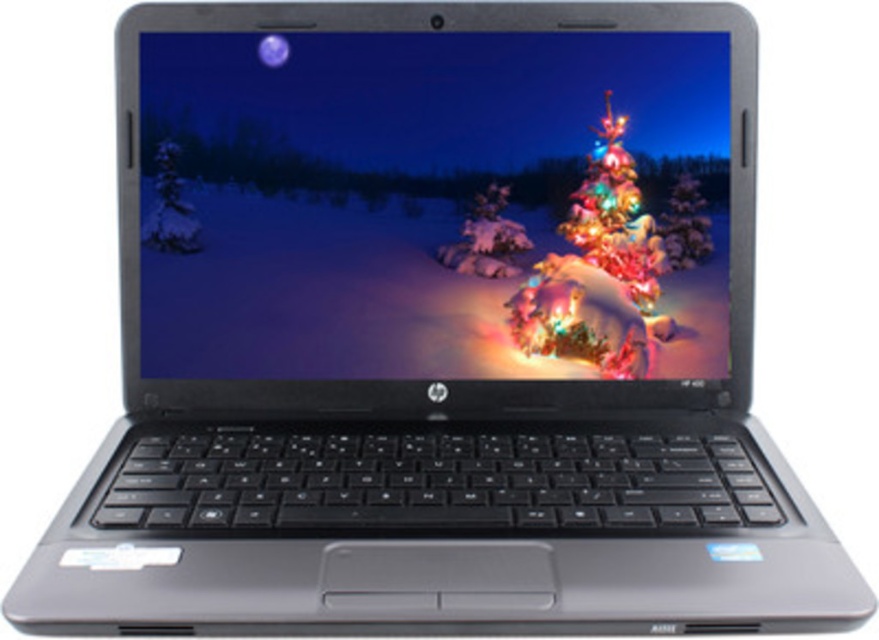
Describe the element at coordinates (404, 195) in the screenshot. Image resolution: width=879 pixels, height=640 pixels. I see `matte plastic screen at center` at that location.

Which is more to the left, matte plastic screen at center or iridescent plastic christmas tree at center?

Positioned to the left is matte plastic screen at center.

Where is `matte plastic screen at center`? This screenshot has width=879, height=640. matte plastic screen at center is located at coordinates (404, 195).

Locate an element on the screen. This screenshot has width=879, height=640. matte plastic screen at center is located at coordinates (404, 195).